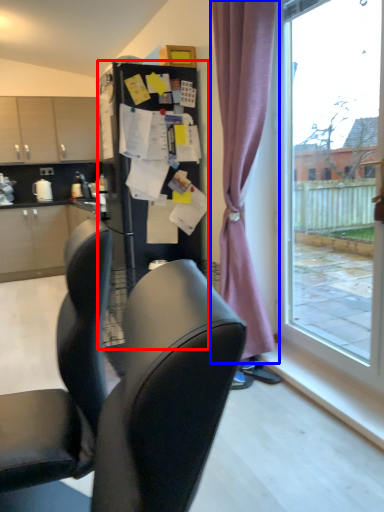
Question: Which point is closer to the camera, fridge (highlighted by a red box) or curtain (highlighted by a blue box)?

Choices:
 (A) fridge
 (B) curtain

Answer: (B)